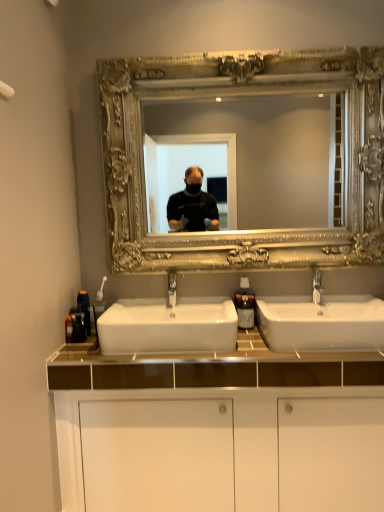
Question: Is silver ornate mirror at upper center bigger than white glossy sink at center, the first sink when ordered from right to left?

Choices:
 (A) yes
 (B) no

Answer: (A)

Question: Would you say silver ornate mirror at upper center contains white glossy sink at center, the first sink when ordered from right to left?

Choices:
 (A) no
 (B) yes

Answer: (A)

Question: Is silver ornate mirror at upper center further to the viewer compared to white glossy sink at center, the first sink when ordered from right to left?

Choices:
 (A) yes
 (B) no

Answer: (A)

Question: Does silver ornate mirror at upper center appear on the right side of white glossy sink at center, arranged as the second sink when viewed from the left?

Choices:
 (A) no
 (B) yes

Answer: (A)

Question: Does silver ornate mirror at upper center have a greater width compared to white glossy sink at center, arranged as the second sink when viewed from the left?

Choices:
 (A) no
 (B) yes

Answer: (A)

Question: Is translucent plastic bottle at left, which is the 1th toiletry in front-to-back order, situated inside silver metallic faucet at center or outside?

Choices:
 (A) inside
 (B) outside

Answer: (B)

Question: Relative to silver metallic faucet at center, is translucent plastic bottle at left, which is the 1th toiletry in front-to-back order, in front or behind?

Choices:
 (A) behind
 (B) front

Answer: (B)

Question: From a real-world perspective, relative to silver metallic faucet at center, is translucent plastic bottle at left, which is the 1th toiletry in front-to-back order, vertically above or below?

Choices:
 (A) above
 (B) below

Answer: (B)

Question: Based on their sizes in the image, would you say translucent plastic bottle at left, which is the 1th toiletry in front-to-back order, is bigger or smaller than silver metallic faucet at center?

Choices:
 (A) small
 (B) big

Answer: (A)

Question: Does point (178, 296) appear closer or farther from the camera than point (97, 300)?

Choices:
 (A) farther
 (B) closer

Answer: (A)

Question: From the image's perspective, relative to white plastic toothbrush at left, which is counted as the 2th soap dispenser, starting from the right, is white glossy sink at center, marked as the second sink in a right-to-left arrangement, above or below?

Choices:
 (A) below
 (B) above

Answer: (A)

Question: Is white glossy sink at center, marked as the second sink in a right-to-left arrangement, situated inside white plastic toothbrush at left, which appears as the first soap dispenser when viewed from the left, or outside?

Choices:
 (A) outside
 (B) inside

Answer: (A)

Question: Based on their positions, is white glossy sink at center, marked as the second sink in a right-to-left arrangement, located to the left or right of white plastic toothbrush at left, which appears as the first soap dispenser when viewed from the left?

Choices:
 (A) right
 (B) left

Answer: (A)

Question: Considering the positions of point (167, 328) and point (309, 331), is point (167, 328) closer or farther from the camera than point (309, 331)?

Choices:
 (A) closer
 (B) farther

Answer: (B)

Question: Is white glossy sink at center, acting as the 1th sink starting from the left, bigger or smaller than white glossy sink at center, the first sink when ordered from right to left?

Choices:
 (A) big
 (B) small

Answer: (B)